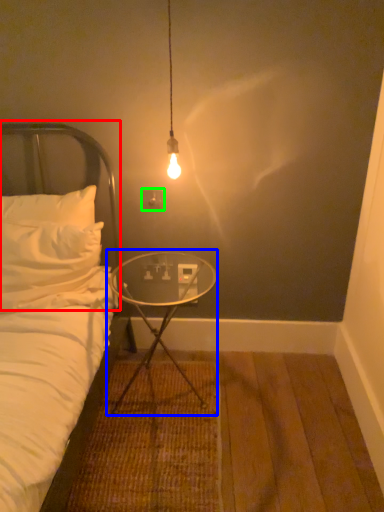
Question: Which is nearer to the headboard (highlighted by a red box)? table (highlighted by a blue box) or electric outlet (highlighted by a green box).

Choices:
 (A) table
 (B) electric outlet

Answer: (B)